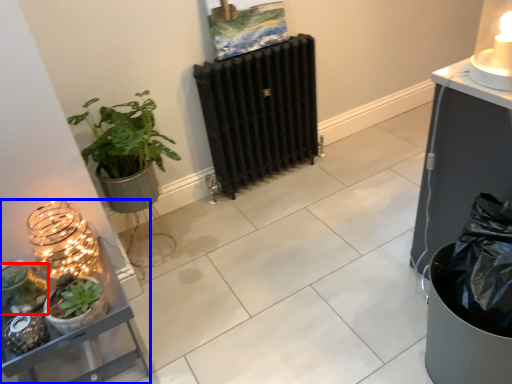
Question: Which object appears closest to the camera in this image, vegetation (highlighted by a red box) or shelf (highlighted by a blue box)?

Choices:
 (A) vegetation
 (B) shelf

Answer: (B)